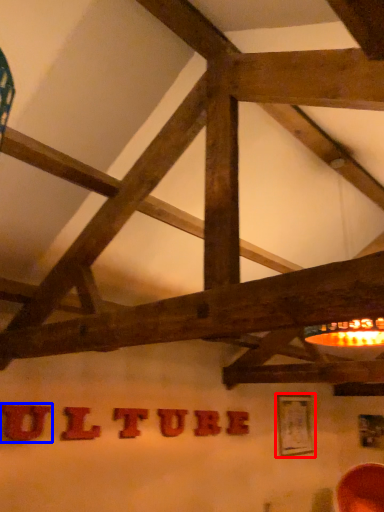
Question: Which point is closer to the camera, picture frame (highlighted by a red box) or letter (highlighted by a blue box)?

Choices:
 (A) picture frame
 (B) letter

Answer: (B)